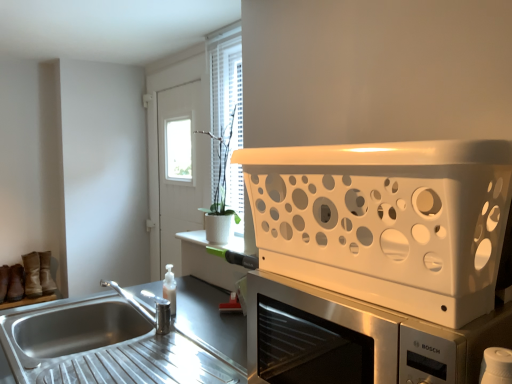
Question: Does white matte microwave oven at upper right appear on the right side of white plastic basket at upper right?

Choices:
 (A) no
 (B) yes

Answer: (B)

Question: Does white matte microwave oven at upper right have a larger size compared to white plastic basket at upper right?

Choices:
 (A) yes
 (B) no

Answer: (B)

Question: Is white matte microwave oven at upper right closer to the viewer compared to white plastic basket at upper right?

Choices:
 (A) no
 (B) yes

Answer: (A)

Question: Is white matte microwave oven at upper right taller than white plastic basket at upper right?

Choices:
 (A) yes
 (B) no

Answer: (A)

Question: From the image's perspective, is white matte microwave oven at upper right located beneath white plastic basket at upper right?

Choices:
 (A) no
 (B) yes

Answer: (B)

Question: From a real-world perspective, relative to leather boot at left, is white matte microwave oven at upper right vertically above or below?

Choices:
 (A) above
 (B) below

Answer: (A)

Question: Considering the positions of point (412, 326) and point (48, 278), is point (412, 326) closer or farther from the camera than point (48, 278)?

Choices:
 (A) farther
 (B) closer

Answer: (B)

Question: From the image's perspective, relative to leather boot at left, is white matte microwave oven at upper right above or below?

Choices:
 (A) above
 (B) below

Answer: (A)

Question: In the image, is white matte microwave oven at upper right on the left side or the right side of leather boot at left?

Choices:
 (A) right
 (B) left

Answer: (A)

Question: In terms of width, does stainless steel sink at lower left look wider or thinner when compared to white plastic basket at upper right?

Choices:
 (A) thin
 (B) wide

Answer: (B)

Question: From their relative heights in the image, would you say stainless steel sink at lower left is taller or shorter than white plastic basket at upper right?

Choices:
 (A) short
 (B) tall

Answer: (A)

Question: Would you say stainless steel sink at lower left is inside or outside white plastic basket at upper right?

Choices:
 (A) outside
 (B) inside

Answer: (A)

Question: Does point (242, 316) appear closer or farther from the camera than point (494, 233)?

Choices:
 (A) farther
 (B) closer

Answer: (A)

Question: Considering their positions, is suede brown shoe at left, the 1th shoe in the right-to-left sequence, located in front of or behind stainless steel sink at lower left?

Choices:
 (A) behind
 (B) front

Answer: (A)

Question: Considering the positions of suede brown shoe at left, marked as the 3th shoe in a left-to-right arrangement, and stainless steel sink at lower left in the image, is suede brown shoe at left, marked as the 3th shoe in a left-to-right arrangement, wider or thinner than stainless steel sink at lower left?

Choices:
 (A) thin
 (B) wide

Answer: (A)